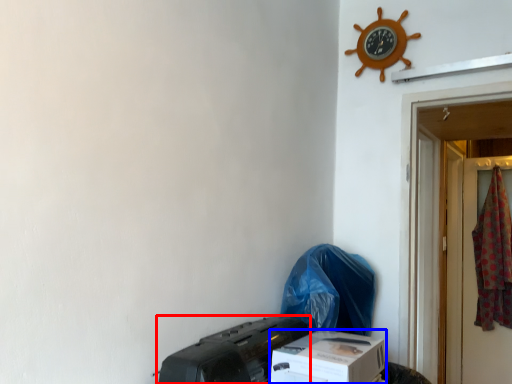
Question: Which object is closer to the camera taking this photo, printer (highlighted by a red box) or box (highlighted by a blue box)?

Choices:
 (A) printer
 (B) box

Answer: (A)